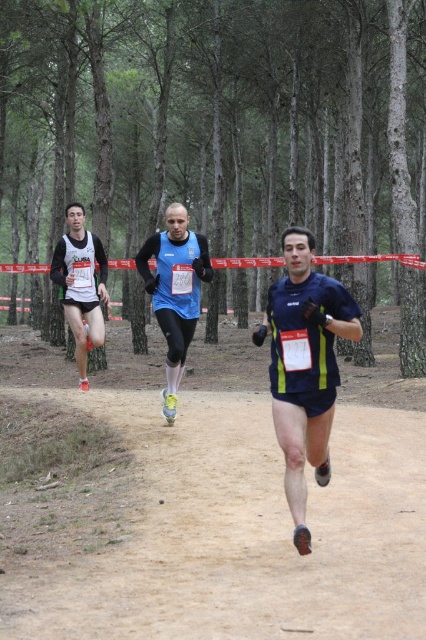
Question: In this image, where is dark blue athletic shorts at center located relative to blue fabric running suit at center?

Choices:
 (A) above
 (B) below

Answer: (B)

Question: Can you confirm if blue fabric running suit at center is wider than matte black shorts at left?

Choices:
 (A) yes
 (B) no

Answer: (A)

Question: Is blue fabric running suit at center to the left of matte black shorts at left from the viewer's perspective?

Choices:
 (A) no
 (B) yes

Answer: (A)

Question: Which point appears farthest from the camera in this image?

Choices:
 (A) (281, 339)
 (B) (68, 301)
 (C) (232, 76)

Answer: (C)

Question: Which point appears farthest from the camera in this image?

Choices:
 (A) (310, 538)
 (B) (94, 246)
 (C) (259, 19)

Answer: (C)

Question: Which point is closer to the camera taking this photo?

Choices:
 (A) (77, 246)
 (B) (184, 308)

Answer: (B)